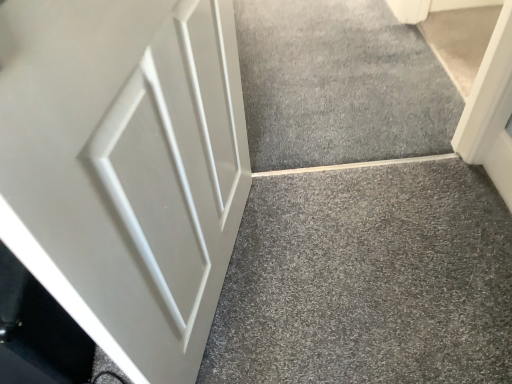
Question: Visually, is gray carpet at center positioned to the left or to the right of white matte door at left?

Choices:
 (A) right
 (B) left

Answer: (A)

Question: From the image's perspective, is gray carpet at center positioned above or below white matte door at left?

Choices:
 (A) above
 (B) below

Answer: (A)

Question: From their relative heights in the image, would you say gray carpet at center is taller or shorter than white matte door at left?

Choices:
 (A) short
 (B) tall

Answer: (A)

Question: Does point (137, 192) appear closer or farther from the camera than point (238, 44)?

Choices:
 (A) farther
 (B) closer

Answer: (B)

Question: Looking at their shapes, would you say white matte door at left is wider or thinner than gray carpet at center?

Choices:
 (A) wide
 (B) thin

Answer: (B)

Question: Looking at the image, does white matte door at left seem bigger or smaller compared to gray carpet at center?

Choices:
 (A) small
 (B) big

Answer: (B)

Question: Is white matte door at left in front of or behind gray carpet at center in the image?

Choices:
 (A) behind
 (B) front

Answer: (B)